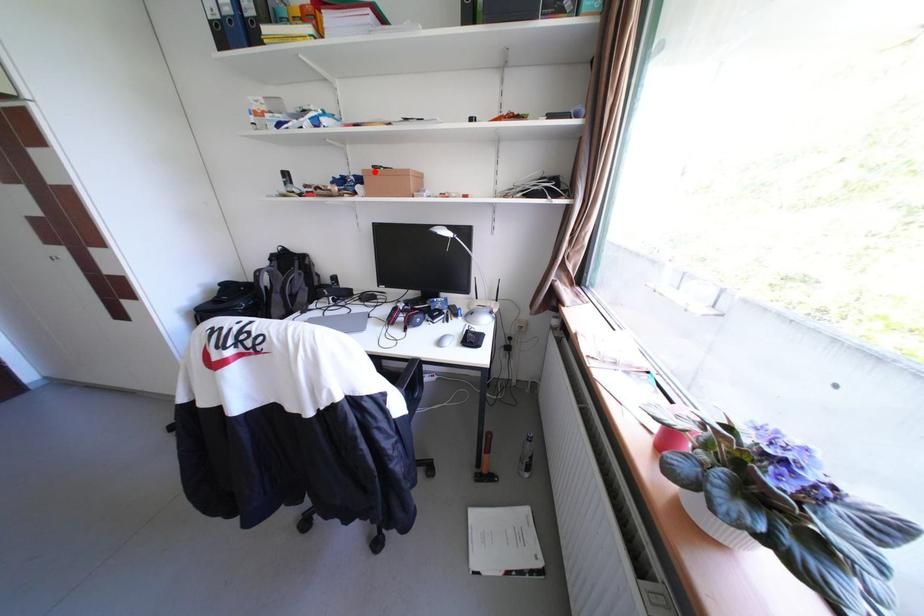
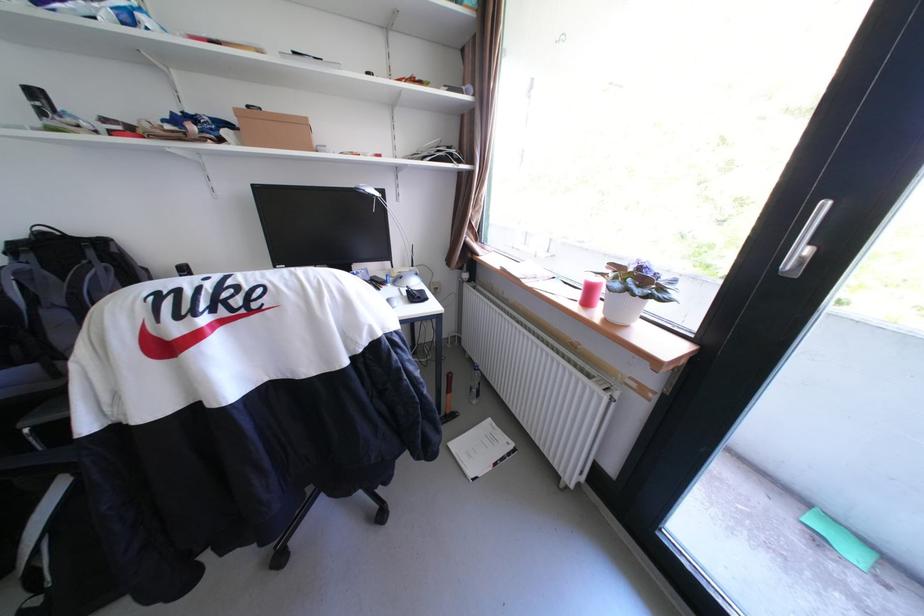
Where in the second image is the point corresponding to the highlighted location from the first image?

(247, 111)